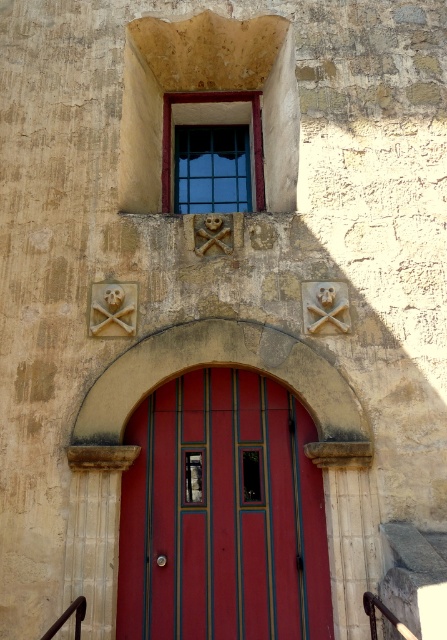
Who is shorter, smooth glossy wood door at center or gray stone stair at lower right?

Standing shorter between the two is gray stone stair at lower right.

Is point (227, 506) closer to camera compared to point (430, 596)?

No, (227, 506) is further to viewer.

Identify the location of smooth glossy wood door at center. This screenshot has height=640, width=447. (223, 515).

Between smooth glossy wood door at center and clear glass window at upper center, which one has more height?

With more height is smooth glossy wood door at center.

Is smooth glossy wood door at center positioned in front of clear glass window at upper center?

Yes, smooth glossy wood door at center is in front of clear glass window at upper center.

Does point (157, 467) lie behind point (205, 102)?

No, (157, 467) is closer to viewer.

Where is `smooth glossy wood door at center`? The width and height of the screenshot is (447, 640). smooth glossy wood door at center is located at coordinates (223, 515).

Who is more distant from viewer, (x=420, y=541) or (x=164, y=122)?

The point (x=164, y=122) is behind.

Can you confirm if gray stone stair at lower right is bigger than clear glass window at upper center?

Actually, gray stone stair at lower right might be smaller than clear glass window at upper center.

Is point (410, 566) positioned in front of point (168, 172)?

That is True.

The image size is (447, 640). What are the coordinates of `gray stone stair at lower right` in the screenshot? It's located at tap(414, 577).